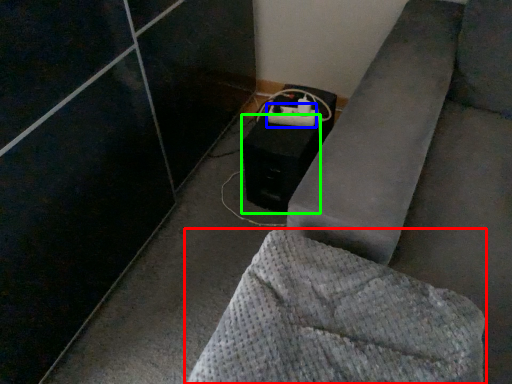
Question: Which object is the closest to the furniture (highlighted by a red box)? Choose among these: extension cord (highlighted by a blue box) or speaker (highlighted by a green box).

Choices:
 (A) extension cord
 (B) speaker

Answer: (B)